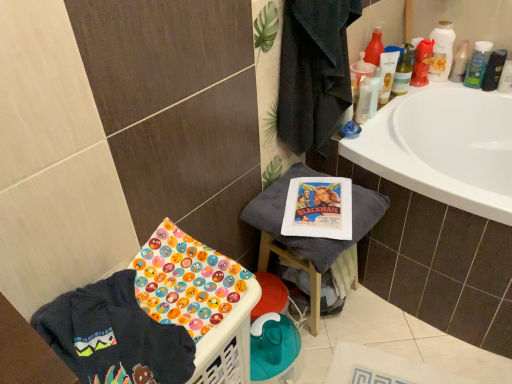
At what (x,y) coordinates should I click in order to perform the action: click on empty space that is ontop of white cotton towel at center (from a real-world perspective). Please return your answer as a coordinate pair (x, y). The height and width of the screenshot is (384, 512). Looking at the image, I should click on (310, 194).